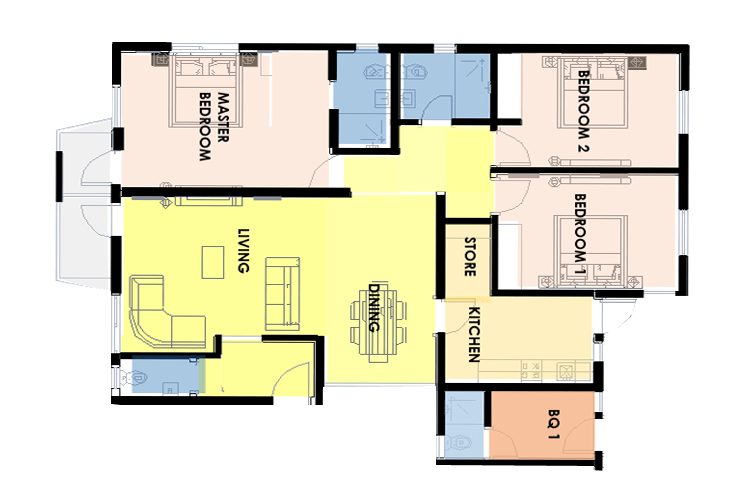
You are a GUI agent. You are given a task and a screenshot of the screen. Output one action in this format:
    pyautogui.click(x=<x>, y=<y>)
    Task: Click on the toilet
    The width and height of the screenshot is (750, 500).
    Given the screenshot: What is the action you would take?
    pyautogui.click(x=372, y=68), pyautogui.click(x=416, y=67)